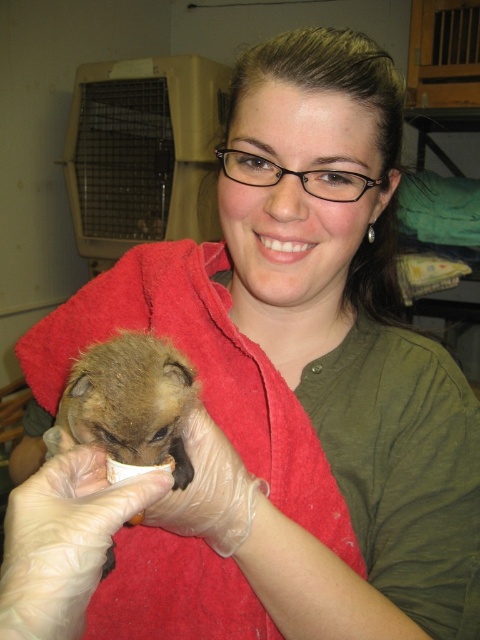
Question: Which object is positioned closest to the transparent plastic glove at lower left?

Choices:
 (A) brown fuzzy bat at center
 (B) transparent plastic glove at center

Answer: (A)

Question: Is transparent plastic glove at lower left positioned at the back of transparent plastic glove at center?

Choices:
 (A) no
 (B) yes

Answer: (A)

Question: Can you confirm if transparent plastic glove at lower left is positioned above brown fuzzy bat at center?

Choices:
 (A) yes
 (B) no

Answer: (B)

Question: Can you confirm if transparent plastic glove at lower left is bigger than brown fuzzy bat at center?

Choices:
 (A) yes
 (B) no

Answer: (B)

Question: Which of the following is the closest to the observer?

Choices:
 (A) transparent plastic glove at center
 (B) transparent plastic glove at lower left
 (C) brown fuzzy bat at center

Answer: (B)

Question: Which of the following is the closest to the observer?

Choices:
 (A) (153, 452)
 (B) (54, 467)

Answer: (B)